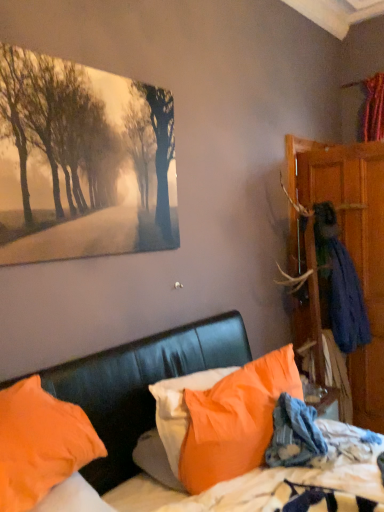
Question: In the image, is blue fabric coat at right positioned in front of or behind orange fabric pillow at center, which ranks as the 3th pillow in left-to-right order?

Choices:
 (A) front
 (B) behind

Answer: (B)

Question: From a real-world perspective, relative to orange fabric pillow at center, which ranks as the 3th pillow in left-to-right order, is blue fabric coat at right vertically above or below?

Choices:
 (A) below
 (B) above

Answer: (B)

Question: Which object is the farthest from the blue fabric coat at right?

Choices:
 (A) orange fabric pillow at lower left, the 3th pillow viewed from the right
 (B) orange fabric pillow at center, which ranks as the 3th pillow in left-to-right order
 (C) orange fabric pillow at center, the second pillow when ordered from left to right
 (D) matte canvas painting at upper left
 (E) wooden wardrobe at right

Answer: (A)

Question: Estimate the real-world distances between objects in this image. Which object is farther from the matte canvas painting at upper left?

Choices:
 (A) orange fabric pillow at center, positioned as the 1th pillow in right-to-left order
 (B) wooden wardrobe at right
 (C) orange fabric pillow at lower left, placed as the first pillow when sorted from left to right
 (D) orange fabric pillow at center, the second pillow when ordered from right to left
 (E) blue fabric coat at right

Answer: (B)